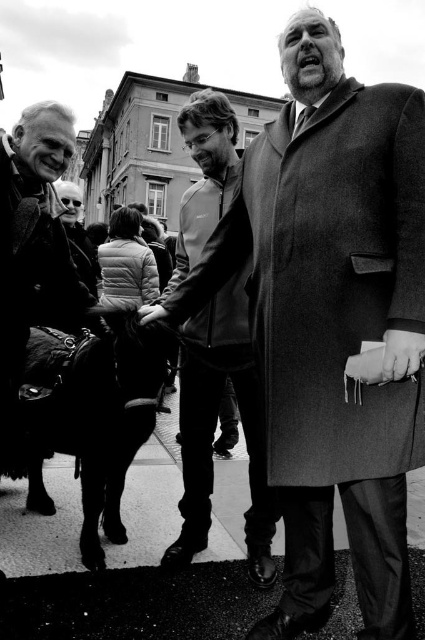
Question: Does leather jacket at left have a smaller size compared to gray wool coat at center?

Choices:
 (A) yes
 (B) no

Answer: (B)

Question: Is leather jacket at left to the right of smooth leather hand at center from the viewer's perspective?

Choices:
 (A) no
 (B) yes

Answer: (A)

Question: Does smooth gray coat at right appear under smooth wool coat at center?

Choices:
 (A) yes
 (B) no

Answer: (A)

Question: Which of the following is the closest to the observer?

Choices:
 (A) dark gray coat at center
 (B) leather jacket at left
 (C) smooth wool coat at center

Answer: (C)

Question: Which of the following is the farthest from the observer?

Choices:
 (A) (325, 435)
 (B) (71, 196)
 (C) (141, 316)
 (D) (207, 132)

Answer: (B)

Question: Among these objects, which one is farthest from the camera?

Choices:
 (A) smooth black jacket at center
 (B) smooth leather hand at center
 (C) dark gray coat at center
 (D) gray wool coat at center

Answer: (D)